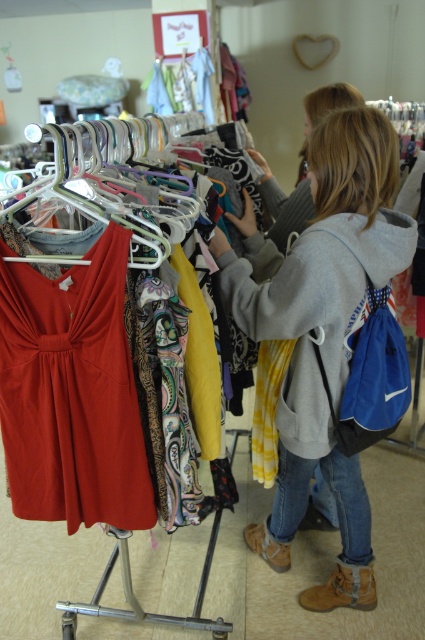
Question: Is matte red dress at center wider than yellow tie-dye shirt at center?

Choices:
 (A) yes
 (B) no

Answer: (B)

Question: Which point appears closest to the camera in this image?

Choices:
 (A) (345, 493)
 (B) (85, 515)
 (C) (186, 221)

Answer: (C)

Question: Can you confirm if yellow tie-dye shirt at center is smaller than metallic silver hanger at upper left?

Choices:
 (A) no
 (B) yes

Answer: (A)

Question: From the image, what is the correct spatial relationship of matte red dress at center in relation to yellow tie-dye shirt at center?

Choices:
 (A) left
 (B) right

Answer: (A)

Question: Considering the real-world distances, which object is closest to the metallic silver hanger at upper left?

Choices:
 (A) yellow tie-dye shirt at center
 (B) matte red dress at center

Answer: (B)

Question: Which point appears closest to the camera in this image?

Choices:
 (A) pos(51,435)
 (B) pos(309,230)

Answer: (A)